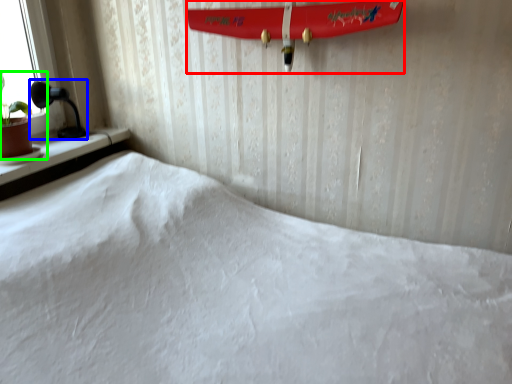
Question: Based on their relative distances, which object is nearer to surfboard (highlighted by a red box)? Choose from table lamp (highlighted by a blue box) and houseplant (highlighted by a green box).

Choices:
 (A) table lamp
 (B) houseplant

Answer: (A)